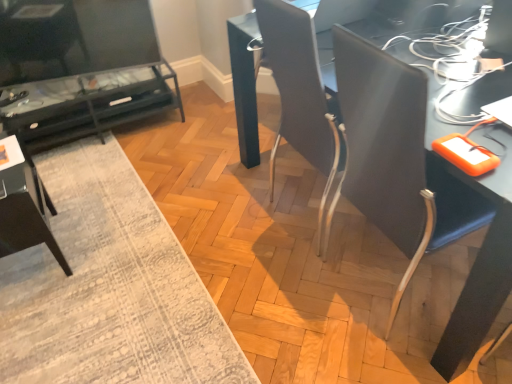
Question: Is dark gray fabric armchair at lower left further to the viewer compared to matte black tv stand at left, which ranks as the first table in left-to-right order?

Choices:
 (A) no
 (B) yes

Answer: (A)

Question: Is dark gray fabric armchair at lower left to the right of matte black tv stand at left, the 2th table from the right, from the viewer's perspective?

Choices:
 (A) yes
 (B) no

Answer: (B)

Question: Is dark gray fabric armchair at lower left far from matte black tv stand at left, the 2th table from the right?

Choices:
 (A) no
 (B) yes

Answer: (A)

Question: Considering the relative sizes of dark gray fabric armchair at lower left and matte black tv stand at left, which ranks as the 2th table in front-to-back order, in the image provided, is dark gray fabric armchair at lower left shorter than matte black tv stand at left, which ranks as the 2th table in front-to-back order,?

Choices:
 (A) no
 (B) yes

Answer: (A)

Question: Is dark gray fabric armchair at lower left turned away from matte black tv stand at left, the 2th table from the right?

Choices:
 (A) no
 (B) yes

Answer: (B)

Question: Does point (441, 130) appear closer or farther from the camera than point (241, 94)?

Choices:
 (A) closer
 (B) farther

Answer: (A)

Question: From the image's perspective, is matte black desk at center located above or below matte black table at center, which is the first table from front to back?

Choices:
 (A) below
 (B) above

Answer: (A)

Question: Considering the positions of matte black desk at center and matte black table at center, which is the first table from front to back, in the image, is matte black desk at center wider or thinner than matte black table at center, which is the first table from front to back,?

Choices:
 (A) wide
 (B) thin

Answer: (A)

Question: From a real-world perspective, is matte black desk at center positioned above or below matte black table at center, which ranks as the second table in back-to-front order?

Choices:
 (A) below
 (B) above

Answer: (A)

Question: In terms of height, does dark gray fabric armchair at lower left look taller or shorter compared to matte black desk at center?

Choices:
 (A) tall
 (B) short

Answer: (B)

Question: Based on their positions, is dark gray fabric armchair at lower left located to the left or right of matte black desk at center?

Choices:
 (A) right
 (B) left

Answer: (B)

Question: Considering their positions, is dark gray fabric armchair at lower left located in front of or behind matte black desk at center?

Choices:
 (A) behind
 (B) front

Answer: (A)

Question: Is dark gray fabric armchair at lower left inside the boundaries of matte black desk at center, or outside?

Choices:
 (A) inside
 (B) outside

Answer: (B)

Question: Considering their positions, is matte black tv stand at left, which ranks as the first table in left-to-right order, located in front of or behind textured gray rug at lower left?

Choices:
 (A) behind
 (B) front

Answer: (A)

Question: Looking at the image, does matte black tv stand at left, the 2th table from the right, seem bigger or smaller compared to textured gray rug at lower left?

Choices:
 (A) big
 (B) small

Answer: (A)